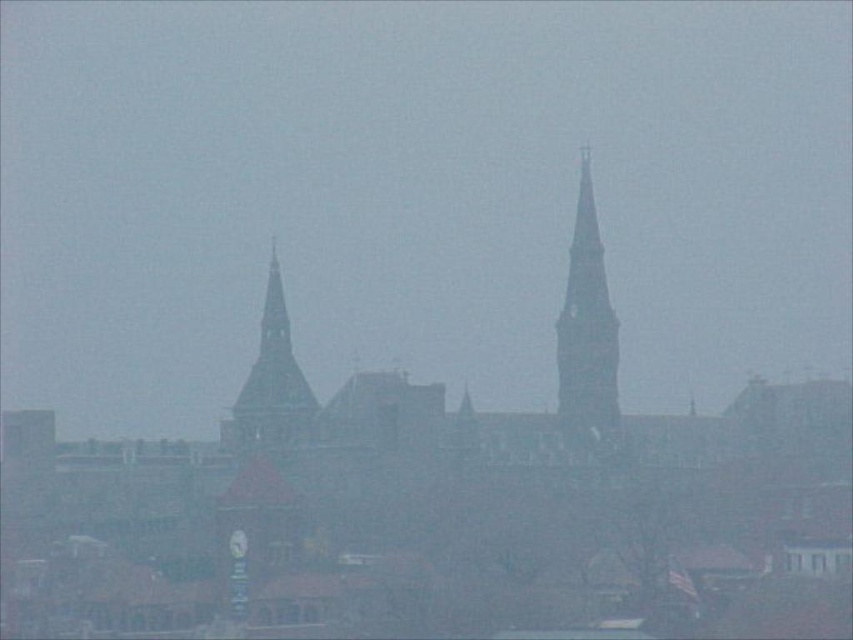
Does smooth gray stone bell tower at center right appear over smooth stone bell tower at center?

Indeed, smooth gray stone bell tower at center right is positioned over smooth stone bell tower at center.

Measure the distance between smooth gray stone bell tower at center right and camera.

smooth gray stone bell tower at center right and camera are 1923.62 feet apart.

Is point (560, 364) more distant than point (257, 435)?

That is True.

In order to click on smooth gray stone bell tower at center right in this screenshot , I will do `click(585, 323)`.